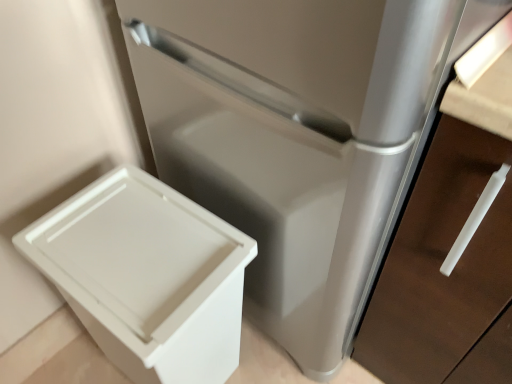
Question: Does white plastic bin at lower left appear on the left side of satin silver drawer at lower right?

Choices:
 (A) yes
 (B) no

Answer: (A)

Question: Considering the relative sizes of white plastic bin at lower left and satin silver drawer at lower right in the image provided, is white plastic bin at lower left wider than satin silver drawer at lower right?

Choices:
 (A) yes
 (B) no

Answer: (B)

Question: Considering the relative positions of white plastic bin at lower left and satin silver drawer at lower right in the image provided, is white plastic bin at lower left behind satin silver drawer at lower right?

Choices:
 (A) yes
 (B) no

Answer: (A)

Question: Is white plastic bin at lower left to the right of satin silver drawer at lower right from the viewer's perspective?

Choices:
 (A) yes
 (B) no

Answer: (B)

Question: Is white plastic bin at lower left aimed at satin silver drawer at lower right?

Choices:
 (A) yes
 (B) no

Answer: (B)

Question: Is white plastic bin at lower left smaller than satin silver drawer at lower right?

Choices:
 (A) no
 (B) yes

Answer: (B)

Question: From a real-world perspective, is satin silver drawer at lower right positioned under white plastic bin at lower left based on gravity?

Choices:
 (A) yes
 (B) no

Answer: (B)

Question: Is white plastic bin at lower left located within satin silver drawer at lower right?

Choices:
 (A) yes
 (B) no

Answer: (B)

Question: From a real-world perspective, does satin silver drawer at lower right stand above white plastic bin at lower left?

Choices:
 (A) yes
 (B) no

Answer: (A)

Question: Does satin silver drawer at lower right have a greater height compared to white plastic bin at lower left?

Choices:
 (A) yes
 (B) no

Answer: (A)

Question: Is satin silver drawer at lower right positioned far away from white plastic bin at lower left?

Choices:
 (A) no
 (B) yes

Answer: (A)

Question: Does satin silver drawer at lower right have a smaller size compared to white plastic bin at lower left?

Choices:
 (A) no
 (B) yes

Answer: (A)

Question: From the image's perspective, is white plastic bin at lower left located above or below satin silver drawer at lower right?

Choices:
 (A) above
 (B) below

Answer: (B)